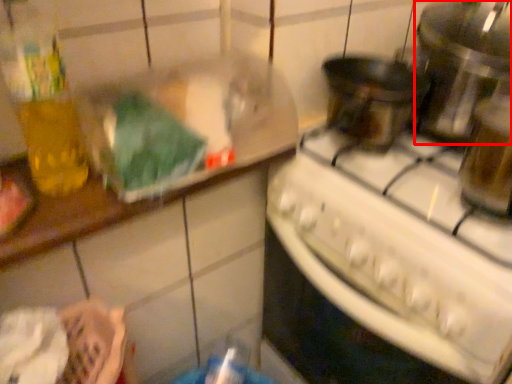
Question: From the image's perspective, considering the relative positions of appliance (annotated by the red box) and kitchen appliance in the image provided, where is appliance (annotated by the red box) located with respect to the staircase?

Choices:
 (A) below
 (B) above

Answer: (B)